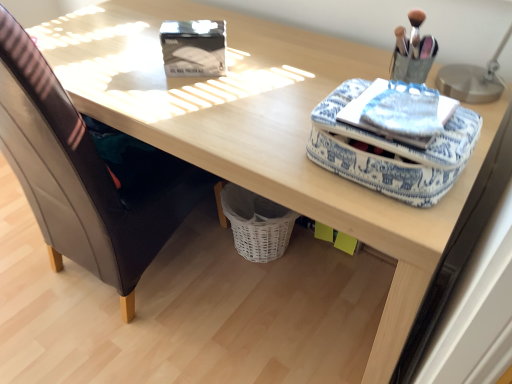
Find the location of a particular element. vacant space to the left of blue fabric case at upper right is located at coordinates (259, 135).